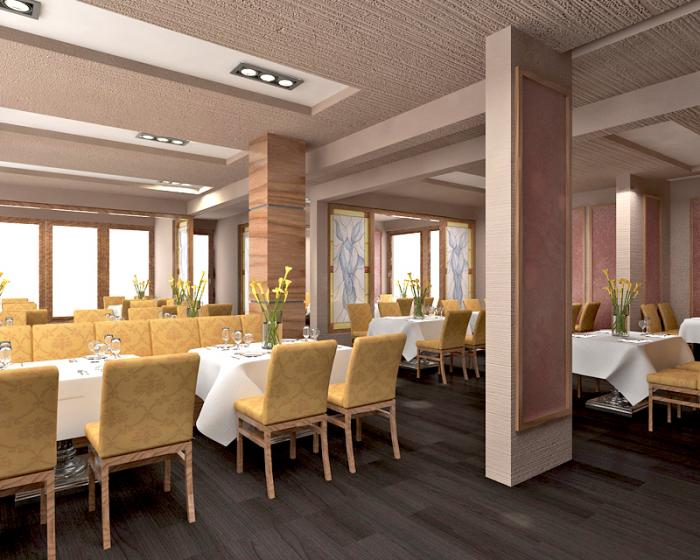
The image size is (700, 560). In order to click on light in this screenshot , I will do `click(15, 6)`, `click(250, 74)`, `click(269, 79)`, `click(286, 84)`, `click(176, 141)`, `click(162, 139)`, `click(147, 138)`.